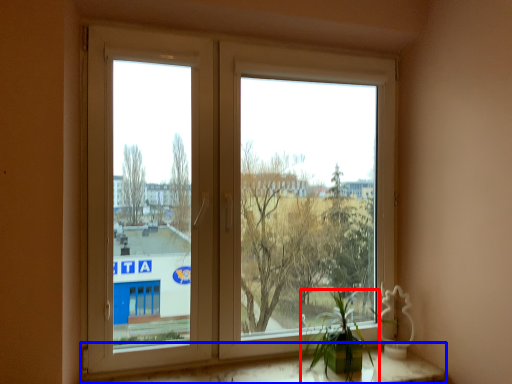
Question: Which point is closer to the camera, houseplant (highlighted by a red box) or window sill (highlighted by a blue box)?

Choices:
 (A) houseplant
 (B) window sill

Answer: (B)